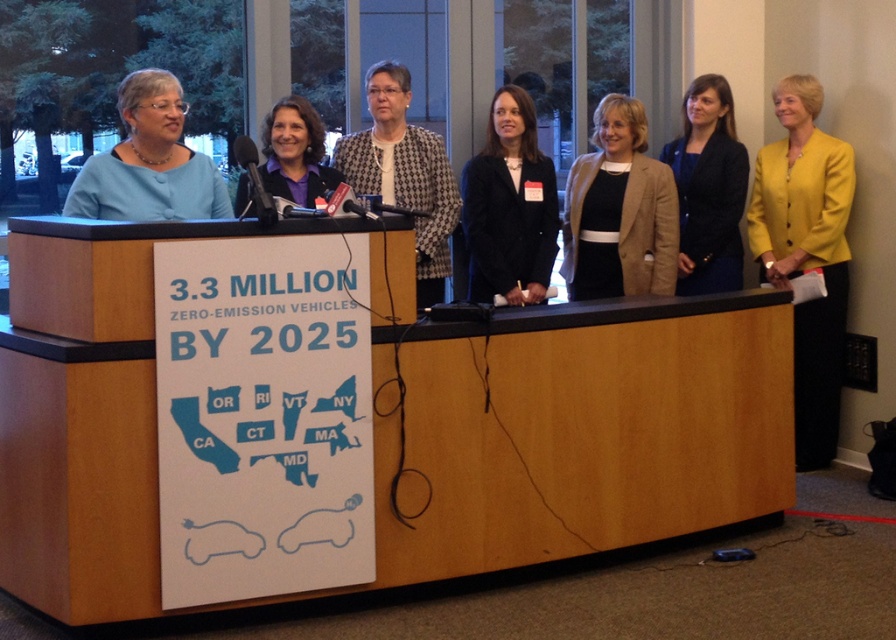
Who is shorter, black matte blazer at center or matte blue blouse at center?

With less height is matte blue blouse at center.

The image size is (896, 640). I want to click on black matte blazer at center, so click(509, 205).

This screenshot has height=640, width=896. What do you see at coordinates (509, 205) in the screenshot? I see `black matte blazer at center` at bounding box center [509, 205].

Image resolution: width=896 pixels, height=640 pixels. What are the coordinates of `black matte blazer at center` in the screenshot? It's located at (509, 205).

Which is more to the right, tan leather blazer at center or matte blue blouse at center?

From the viewer's perspective, tan leather blazer at center appears more on the right side.

Between point (632, 244) and point (101, 157), which one is positioned in front?

Positioned in front is point (101, 157).

What do you see at coordinates (619, 211) in the screenshot? Image resolution: width=896 pixels, height=640 pixels. I see `tan leather blazer at center` at bounding box center [619, 211].

This screenshot has height=640, width=896. Identify the location of tan leather blazer at center. (619, 211).

Is point (110, 570) more distant than point (810, 458)?

No, it is not.

Locate an element on the screen. The width and height of the screenshot is (896, 640). wooden table at center is located at coordinates (389, 420).

Locate an element on the screen. wooden table at center is located at coordinates (389, 420).